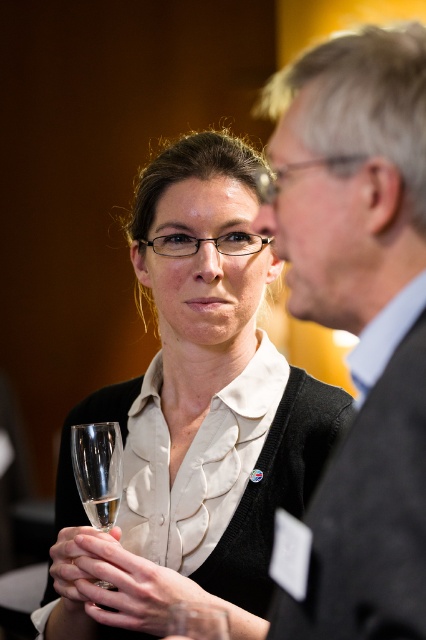
Which is more to the left, black plastic glasses at center or transparent plastic glasses at upper center?

Positioned to the left is black plastic glasses at center.

How far apart are black plastic glasses at center and transparent plastic glasses at upper center?

A distance of 8.18 inches exists between black plastic glasses at center and transparent plastic glasses at upper center.

Does point (224, 237) come closer to viewer compared to point (313, 157)?

That is False.

I want to click on black plastic glasses at center, so click(207, 241).

Is matte gray suit at center positioned behind transparent glass at lower left?

No.

Does matte gray suit at center have a lesser height compared to transparent glass at lower left?

Incorrect, matte gray suit at center's height does not fall short of transparent glass at lower left's.

Between point (422, 193) and point (120, 480), which one is positioned in front?

Point (422, 193) is more forward.

Where is `matte gray suit at center`? The image size is (426, 640). matte gray suit at center is located at coordinates (359, 317).

Does matte black sweater at center have a greater width compared to matte gray suit at center?

Yes.

Between point (221, 477) and point (394, 307), which one is positioned in front?

Point (394, 307) is in front.

Who is more forward, (238, 433) or (417, 509)?

Point (417, 509) is in front.

Identify the location of matte black sweater at center. (199, 401).